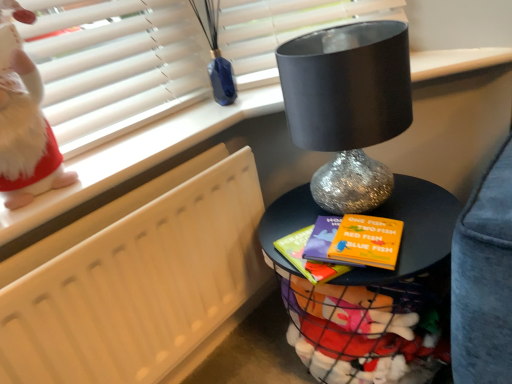
Question: Considering the relative positions of shiny metallic table at center and white matte radiator at left in the image provided, is shiny metallic table at center to the left of white matte radiator at left from the viewer's perspective?

Choices:
 (A) yes
 (B) no

Answer: (B)

Question: From a real-world perspective, is shiny metallic table at center beneath white matte radiator at left?

Choices:
 (A) no
 (B) yes

Answer: (B)

Question: Can you confirm if shiny metallic table at center is wider than white matte radiator at left?

Choices:
 (A) yes
 (B) no

Answer: (A)

Question: Does shiny metallic table at center have a lesser width compared to white matte radiator at left?

Choices:
 (A) no
 (B) yes

Answer: (A)

Question: Is shiny metallic table at center located outside white matte radiator at left?

Choices:
 (A) no
 (B) yes

Answer: (B)

Question: From a real-world perspective, is white fluffy doll at upper left physically located above or below white matte radiator at left?

Choices:
 (A) below
 (B) above

Answer: (B)

Question: In the image, is white fluffy doll at upper left positioned in front of or behind white matte radiator at left?

Choices:
 (A) behind
 (B) front

Answer: (B)

Question: From the image's perspective, is white fluffy doll at upper left positioned above or below white matte radiator at left?

Choices:
 (A) above
 (B) below

Answer: (A)

Question: Is point (25, 87) positioned closer to the camera than point (4, 365)?

Choices:
 (A) closer
 (B) farther

Answer: (B)

Question: Is point (138, 268) closer or farther from the camera than point (385, 339)?

Choices:
 (A) closer
 (B) farther

Answer: (A)

Question: From a real-world perspective, relative to shiny metallic table at center, is white matte radiator at left vertically above or below?

Choices:
 (A) below
 (B) above

Answer: (B)

Question: In terms of size, does white matte radiator at left appear bigger or smaller than shiny metallic table at center?

Choices:
 (A) big
 (B) small

Answer: (B)

Question: In the image, is white matte radiator at left positioned in front of or behind shiny metallic table at center?

Choices:
 (A) behind
 (B) front

Answer: (B)

Question: From the image's perspective, is shiny metallic table at center located above or below white fluffy doll at upper left?

Choices:
 (A) below
 (B) above

Answer: (A)

Question: In terms of width, does shiny metallic table at center look wider or thinner when compared to white fluffy doll at upper left?

Choices:
 (A) thin
 (B) wide

Answer: (B)